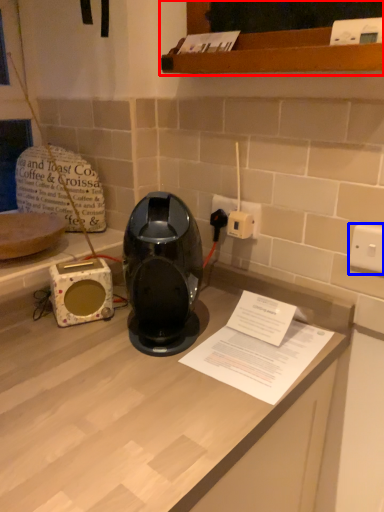
Question: Among these objects, which one is nearest to the camera, cabinetry (highlighted by a red box) or electric outlet (highlighted by a blue box)?

Choices:
 (A) cabinetry
 (B) electric outlet

Answer: (A)